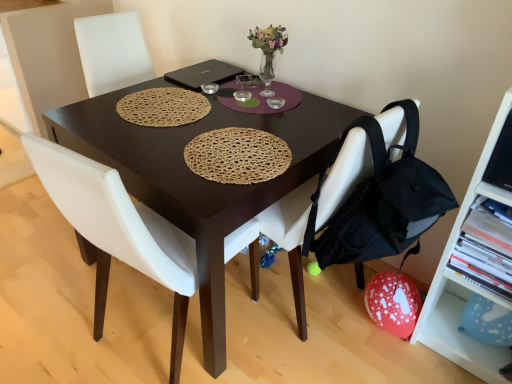
Question: Considering the relative sizes of black matte laptop at center and black fabric backpack at lower right in the image provided, is black matte laptop at center thinner than black fabric backpack at lower right?

Choices:
 (A) no
 (B) yes

Answer: (B)

Question: From a real-world perspective, is black matte laptop at center located beneath black fabric backpack at lower right?

Choices:
 (A) no
 (B) yes

Answer: (A)

Question: Is black fabric backpack at lower right completely or partially inside black matte laptop at center?

Choices:
 (A) yes
 (B) no

Answer: (B)

Question: Does black matte laptop at center have a larger size compared to black fabric backpack at lower right?

Choices:
 (A) yes
 (B) no

Answer: (B)

Question: Can you confirm if black matte laptop at center is shorter than black fabric backpack at lower right?

Choices:
 (A) no
 (B) yes

Answer: (B)

Question: Considering the relative positions of black matte laptop at center and black fabric backpack at lower right in the image provided, is black matte laptop at center in front of black fabric backpack at lower right?

Choices:
 (A) no
 (B) yes

Answer: (A)

Question: Is the depth of white fabric chair at center, positioned as the second chair in left-to-right order, greater than that of blue paper balloon at lower right, the 1th shelf ordered from the bottom?

Choices:
 (A) yes
 (B) no

Answer: (B)

Question: Is white fabric chair at center, positioned as the second chair in left-to-right order, far from blue paper balloon at lower right, the 1th shelf ordered from the bottom?

Choices:
 (A) yes
 (B) no

Answer: (B)

Question: From a real-world perspective, does white fabric chair at center, positioned as the second chair in left-to-right order, sit lower than blue paper balloon at lower right, the 1th shelf ordered from the bottom?

Choices:
 (A) no
 (B) yes

Answer: (A)

Question: Is the position of white fabric chair at center, which is counted as the first chair, starting from the right, less distant than that of blue paper balloon at lower right, the 1th shelf ordered from the bottom?

Choices:
 (A) no
 (B) yes

Answer: (B)

Question: Does white fabric chair at center, positioned as the second chair in left-to-right order, have a lesser height compared to blue paper balloon at lower right, which is counted as the 3th shelf, starting from the top?

Choices:
 (A) no
 (B) yes

Answer: (A)

Question: Does white fabric chair at center, which is counted as the first chair, starting from the right, have a greater height compared to blue paper balloon at lower right, which is counted as the 3th shelf, starting from the top?

Choices:
 (A) yes
 (B) no

Answer: (A)

Question: From a real-world perspective, is black fabric backpack at lower right on top of blue paper balloon at lower right, which is counted as the 3th shelf, starting from the top?

Choices:
 (A) yes
 (B) no

Answer: (A)